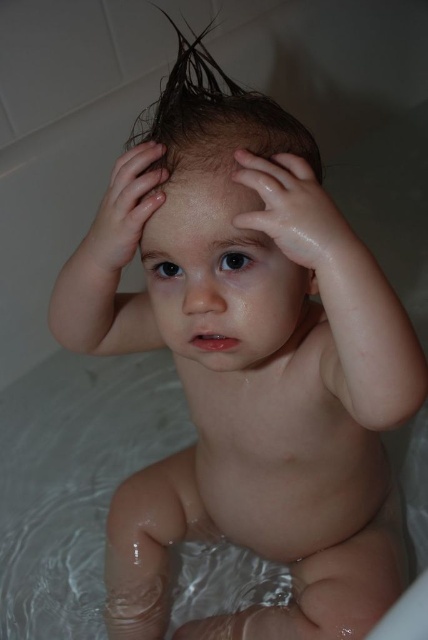
You are a photographer setting up a shoot in a bathroom. You notice the wet brown hair at upper center and the glossy skin hand at upper center. Which object is located above the other?

The wet brown hair at upper center is positioned over the glossy skin hand at upper center, so the wet brown hair is above the glossy skin hand.

You are a robotic arm trying to reach the glossy skin hand at upper center in the bathtub. Your maximum reach is 5 inches. Can you reach it from the glossy wet hand at center?

The distance between the glossy wet hand at center and the glossy skin hand at upper center is 5.12 inches, which exceeds your 5 inch reach. Therefore, you cannot reach the glossy skin hand at upper center from the glossy wet hand at center.

You are a caregiver observing the child in the bathtub. You notice two glossy hands. Which hand is thinner between the glossy wet hand at center and the glossy skin hand at upper center?

The glossy wet hand at center is thinner than the glossy skin hand at upper center.